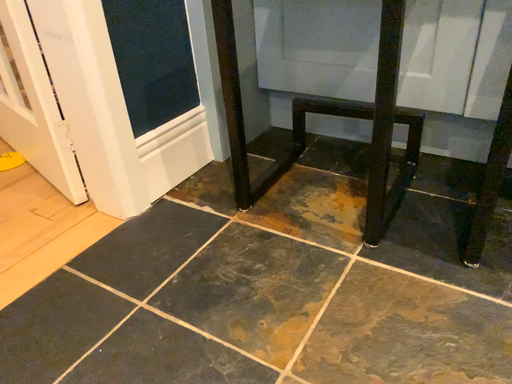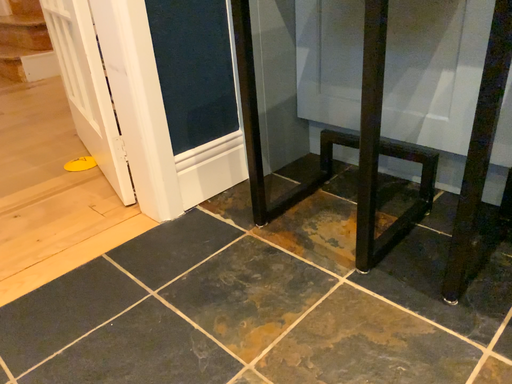
Question: Which way did the camera rotate in the video?

Choices:
 (A) rotated right
 (B) rotated left

Answer: (B)